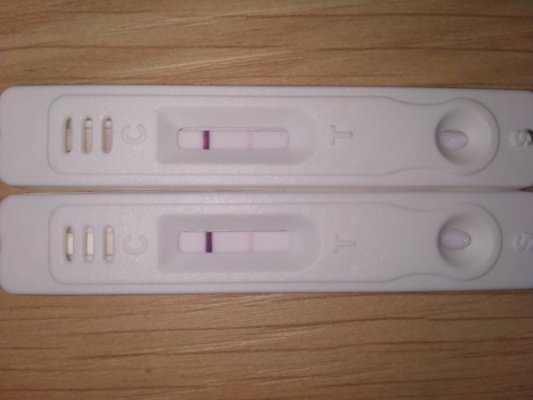
Identify the location of light line. (249, 241), (251, 139).